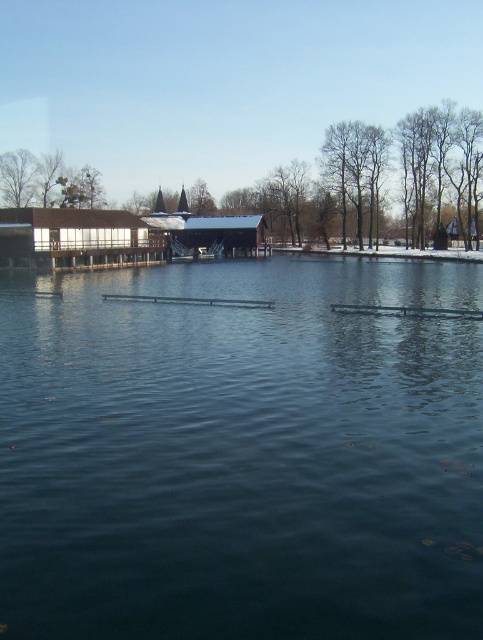
You are standing at the edge of the lakeside and want to place a small wooden boat exactly at the center of the dark blue water at center. According to the coordinates provided, where should you position the boat?

The dark blue water at center is located at coordinates point (241, 454), so you should position the boat there.

You are standing on the lakeside path and want to cross to the other side. The dark blue water at center and the brown leafless tree at left are in your way. Which one can you walk around more easily?

The dark blue water at center can be walked around more easily because its width is larger than the brown leafless tree at left, making it easier to navigate around the water.